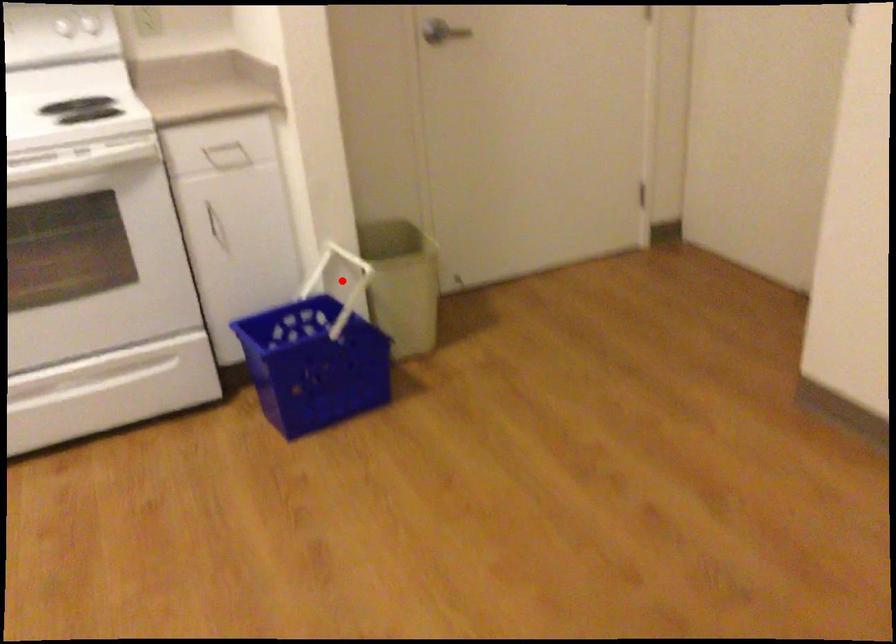
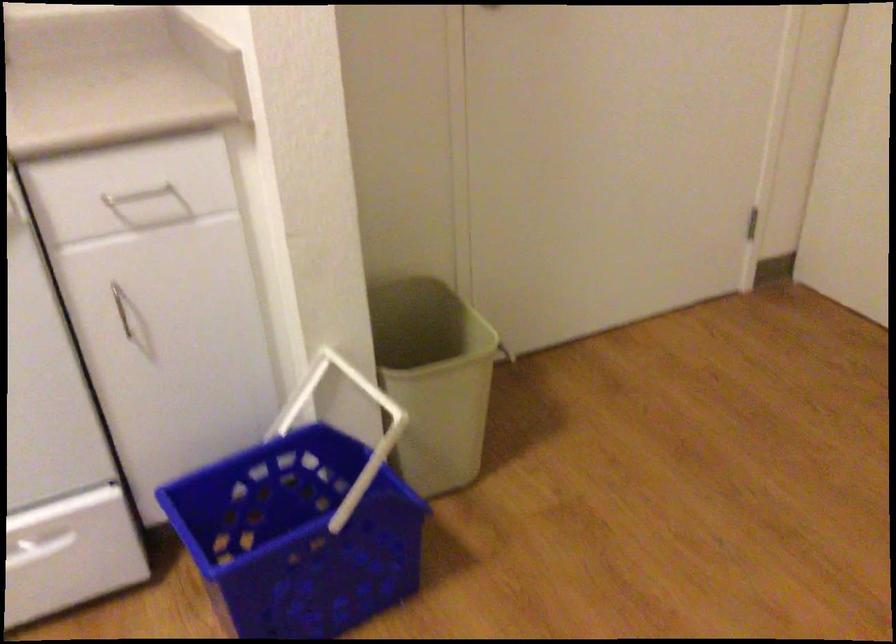
Question: I am providing you with two images of the same scene from different viewpoints. In image1, a red point is highlighted. Considering the same 3D point in image2, which of the following is correct?

Choices:
 (A) It is closer
 (B) It is farther

Answer: (A)